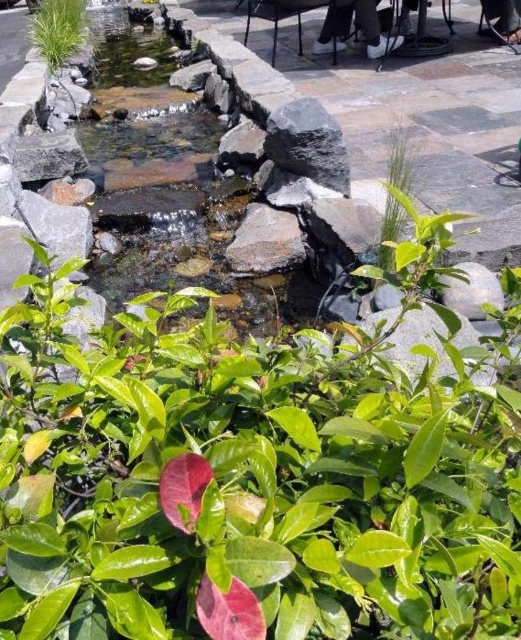
Question: Is smooth gray rock at center above white leather shoes at upper center?

Choices:
 (A) yes
 (B) no

Answer: (B)

Question: Can you confirm if smooth gray rock at center is wider than white leather shoes at upper center?

Choices:
 (A) no
 (B) yes

Answer: (A)

Question: Among these points, which one is nearest to the camera?

Choices:
 (A) (245, 218)
 (B) (336, 48)

Answer: (A)

Question: Which object is closer to the camera taking this photo?

Choices:
 (A) smooth gray rock at center
 (B) white leather shoes at upper center

Answer: (A)

Question: Which object is farther from the camera taking this photo?

Choices:
 (A) white leather shoes at upper center
 (B) smooth gray rock at center

Answer: (A)

Question: Observing the image, what is the correct spatial positioning of smooth gray rock at center in reference to white leather shoes at upper center?

Choices:
 (A) right
 (B) left

Answer: (B)